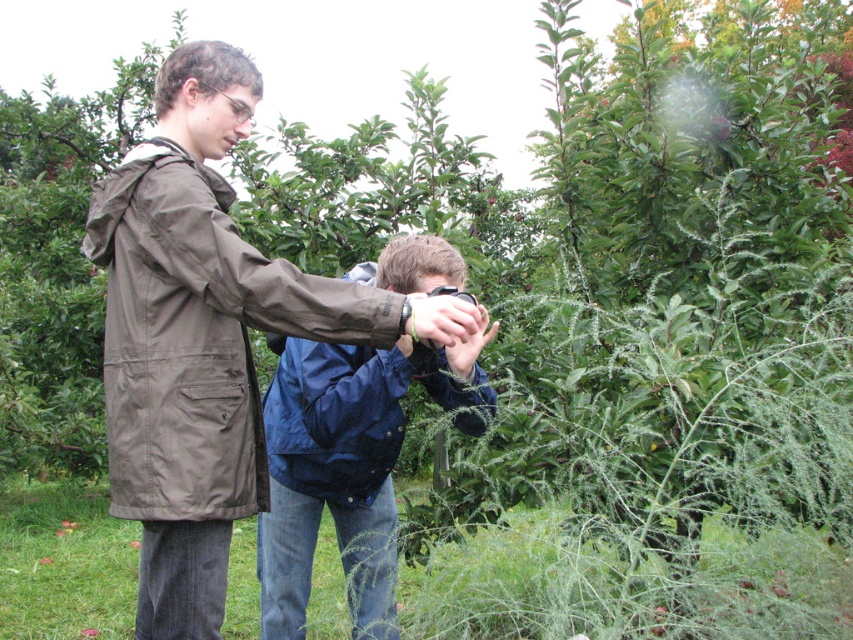
Question: Is matte brown jacket at center further to camera compared to blue fabric camera at center?

Choices:
 (A) yes
 (B) no

Answer: (B)

Question: Can you confirm if matte brown jacket at center is smaller than blue fabric camera at center?

Choices:
 (A) no
 (B) yes

Answer: (A)

Question: Is matte brown jacket at center further to the viewer compared to blue fabric camera at center?

Choices:
 (A) yes
 (B) no

Answer: (B)

Question: Among these points, which one is farthest from the camera?

Choices:
 (A) (207, 269)
 (B) (310, 364)

Answer: (B)